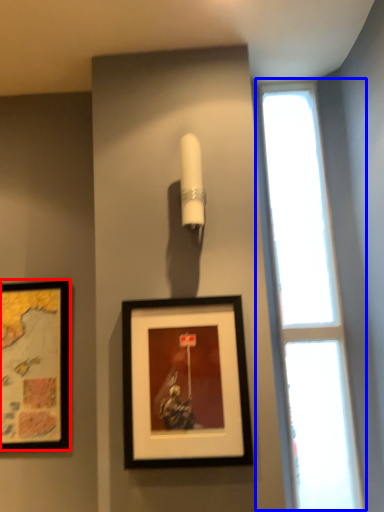
Question: Which of the following is the farthest to the observer, picture frame (highlighted by a red box) or window (highlighted by a blue box)?

Choices:
 (A) picture frame
 (B) window

Answer: (A)